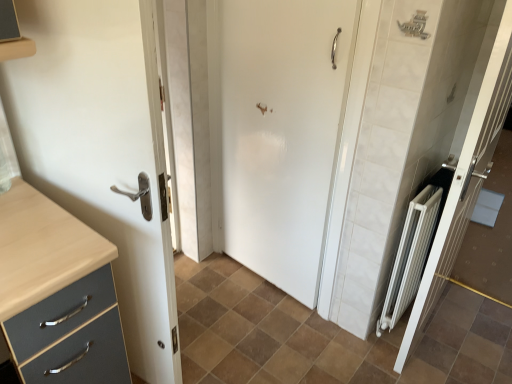
Identify the location of brown matte tile at center. (325, 335).

Locate an element on the screen. The width and height of the screenshot is (512, 384). brown matte tile at center is located at coordinates (325, 335).

Based on their sizes in the image, would you say white metallic radiator at right, marked as the third door in a left-to-right arrangement, is bigger or smaller than white matte door at center, arranged as the second door when viewed from the right?

Clearly, white metallic radiator at right, marked as the third door in a left-to-right arrangement, is larger in size than white matte door at center, arranged as the second door when viewed from the right.

From the image's perspective, is white metallic radiator at right, marked as the third door in a left-to-right arrangement, above white matte door at center, arranged as the 2th door when viewed from the left?

Incorrect, from the image's perspective, white metallic radiator at right, marked as the third door in a left-to-right arrangement, is lower than white matte door at center, arranged as the 2th door when viewed from the left.

From a real-world perspective, relative to white matte door at center, arranged as the second door when viewed from the right, is white metallic radiator at right, marked as the third door in a left-to-right arrangement, vertically above or below?

white metallic radiator at right, marked as the third door in a left-to-right arrangement, is situated higher than white matte door at center, arranged as the second door when viewed from the right, in the real world.

In the image, is white metallic radiator at right, marked as the third door in a left-to-right arrangement, on the left side or the right side of white matte door at center, arranged as the second door when viewed from the right?

Clearly, white metallic radiator at right, marked as the third door in a left-to-right arrangement, is on the right of white matte door at center, arranged as the second door when viewed from the right, in the image.

How distant is white metallic radiator at right, marked as the third door in a left-to-right arrangement, from white glossy door at left, marked as the 1th door in a left-to-right arrangement?

white metallic radiator at right, marked as the third door in a left-to-right arrangement, is 1.20 meters away from white glossy door at left, marked as the 1th door in a left-to-right arrangement.

From the image's perspective, relative to white glossy door at left, which appears as the third door when viewed from the right, is white metallic radiator at right, marked as the 1th door in a right-to-left arrangement, above or below?

white metallic radiator at right, marked as the 1th door in a right-to-left arrangement, is above white glossy door at left, which appears as the third door when viewed from the right.

Is white metallic radiator at right, marked as the 1th door in a right-to-left arrangement, smaller than white glossy door at left, which appears as the third door when viewed from the right?

Indeed, white metallic radiator at right, marked as the 1th door in a right-to-left arrangement, has a smaller size compared to white glossy door at left, which appears as the third door when viewed from the right.

Between white metallic radiator at right, marked as the 1th door in a right-to-left arrangement, and white glossy door at left, marked as the 1th door in a left-to-right arrangement, which one has less height?

Standing shorter between the two is white glossy door at left, marked as the 1th door in a left-to-right arrangement.

Is white glossy door at left, which appears as the third door when viewed from the right, inside or outside of brown matte tile at center?

The correct answer is: outside.

Between white glossy door at left, which appears as the third door when viewed from the right, and brown matte tile at center, which one has larger size?

Bigger between the two is white glossy door at left, which appears as the third door when viewed from the right.

Consider the image. From the image's perspective, between white glossy door at left, which appears as the third door when viewed from the right, and brown matte tile at center, who is located below?

brown matte tile at center, from the image's perspective.

Is white glossy door at left, which appears as the third door when viewed from the right, facing towards brown matte tile at center?

No, white glossy door at left, which appears as the third door when viewed from the right, does not turn towards brown matte tile at center.

Does white matte door at center, arranged as the 2th door when viewed from the left, appear on the right side of brown matte tile at center?

Incorrect, white matte door at center, arranged as the 2th door when viewed from the left, is not on the right side of brown matte tile at center.

Between white matte door at center, arranged as the 2th door when viewed from the left, and brown matte tile at center, which one has larger size?

brown matte tile at center.

From the picture: Measure the distance between white matte door at center, arranged as the second door when viewed from the right, and brown matte tile at center.

white matte door at center, arranged as the second door when viewed from the right, and brown matte tile at center are 28.48 inches apart from each other.

Does white matte door at center, arranged as the second door when viewed from the right, have a greater height compared to brown matte tile at center?

Yes, white matte door at center, arranged as the second door when viewed from the right, is taller than brown matte tile at center.

Does white glossy door at left, which appears as the third door when viewed from the right, come behind white matte door at center, arranged as the second door when viewed from the right?

No, white glossy door at left, which appears as the third door when viewed from the right, is in front of white matte door at center, arranged as the second door when viewed from the right.

From the image's perspective, is white glossy door at left, which appears as the third door when viewed from the right, above or below white matte door at center, arranged as the 2th door when viewed from the left?

Clearly, from the image's perspective, white glossy door at left, which appears as the third door when viewed from the right, is below white matte door at center, arranged as the 2th door when viewed from the left.

Are white glossy door at left, marked as the 1th door in a left-to-right arrangement, and white matte door at center, arranged as the 2th door when viewed from the left, far apart?

No.

Between white glossy door at left, which appears as the third door when viewed from the right, and white matte door at center, arranged as the second door when viewed from the right, which one appears on the right side from the viewer's perspective?

From the viewer's perspective, white matte door at center, arranged as the second door when viewed from the right, appears more on the right side.

Is white glossy door at left, which appears as the third door when viewed from the right, looking in the opposite direction of white metallic radiator at right, marked as the 1th door in a right-to-left arrangement?

That's not correct — white glossy door at left, which appears as the third door when viewed from the right, is not looking away from white metallic radiator at right, marked as the 1th door in a right-to-left arrangement.

From the image's perspective, is white glossy door at left, which appears as the third door when viewed from the right, on top of white metallic radiator at right, marked as the third door in a left-to-right arrangement?

No, from the image's perspective, white glossy door at left, which appears as the third door when viewed from the right, is not above white metallic radiator at right, marked as the third door in a left-to-right arrangement.

Considering the relative sizes of white glossy door at left, marked as the 1th door in a left-to-right arrangement, and white metallic radiator at right, marked as the third door in a left-to-right arrangement, in the image provided, is white glossy door at left, marked as the 1th door in a left-to-right arrangement, shorter than white metallic radiator at right, marked as the third door in a left-to-right arrangement,?

Correct, white glossy door at left, marked as the 1th door in a left-to-right arrangement, is not as tall as white metallic radiator at right, marked as the third door in a left-to-right arrangement.

Which of these two, white glossy door at left, marked as the 1th door in a left-to-right arrangement, or white metallic radiator at right, marked as the 1th door in a right-to-left arrangement, is thinner?

white metallic radiator at right, marked as the 1th door in a right-to-left arrangement, is thinner.

Is brown matte tile at center facing away from white metallic radiator at right, marked as the third door in a left-to-right arrangement?

brown matte tile at center does not have its back to white metallic radiator at right, marked as the third door in a left-to-right arrangement.

In the scene shown: Between brown matte tile at center and white metallic radiator at right, marked as the third door in a left-to-right arrangement, which one is positioned in front?

Positioned in front is white metallic radiator at right, marked as the third door in a left-to-right arrangement.

Considering the relative sizes of brown matte tile at center and white metallic radiator at right, marked as the 1th door in a right-to-left arrangement, in the image provided, is brown matte tile at center smaller than white metallic radiator at right, marked as the 1th door in a right-to-left arrangement,?

No.

I want to click on door located above the white metallic radiator at right, marked as the third door in a left-to-right arrangement (from the image's perspective), so click(x=283, y=132).

What are the coordinates of `door lying below the white metallic radiator at right, marked as the third door in a left-to-right arrangement (from the image's perspective)` in the screenshot? It's located at (102, 151).

Looking at this image, based on their spatial positions, is brown matte tile at center or white metallic radiator at right, marked as the 1th door in a right-to-left arrangement, closer to white matte door at center, arranged as the second door when viewed from the right?

white metallic radiator at right, marked as the 1th door in a right-to-left arrangement.

From the image, which object appears to be nearer to white glossy door at left, marked as the 1th door in a left-to-right arrangement, white metallic radiator at right, marked as the third door in a left-to-right arrangement, or brown matte tile at center?

Based on the image, brown matte tile at center appears to be nearer to white glossy door at left, marked as the 1th door in a left-to-right arrangement.

When comparing their distances from white glossy door at left, marked as the 1th door in a left-to-right arrangement, does brown matte tile at center or white matte door at center, arranged as the 2th door when viewed from the left, seem closer?

Based on the image, white matte door at center, arranged as the 2th door when viewed from the left, appears to be nearer to white glossy door at left, marked as the 1th door in a left-to-right arrangement.

From the picture: Estimate the real-world distances between objects in this image. Which object is further from white metallic radiator at right, marked as the third door in a left-to-right arrangement, white glossy door at left, marked as the 1th door in a left-to-right arrangement, or brown matte tile at center?

white glossy door at left, marked as the 1th door in a left-to-right arrangement, is further to white metallic radiator at right, marked as the third door in a left-to-right arrangement.

From the image, which object appears to be farther from white metallic radiator at right, marked as the 1th door in a right-to-left arrangement, brown matte tile at center or white matte door at center, arranged as the 2th door when viewed from the left?

Based on the image, white matte door at center, arranged as the 2th door when viewed from the left, appears to be further to white metallic radiator at right, marked as the 1th door in a right-to-left arrangement.

Which object lies further to the anchor point white metallic radiator at right, marked as the 1th door in a right-to-left arrangement, white matte door at center, arranged as the 2th door when viewed from the left, or brown matte tile at center?

The object further to white metallic radiator at right, marked as the 1th door in a right-to-left arrangement, is white matte door at center, arranged as the 2th door when viewed from the left.

From the image, which object appears to be nearer to white glossy door at left, which appears as the third door when viewed from the right, white matte door at center, arranged as the second door when viewed from the right, or white metallic radiator at right, marked as the 1th door in a right-to-left arrangement?

Among the two, white matte door at center, arranged as the second door when viewed from the right, is located nearer to white glossy door at left, which appears as the third door when viewed from the right.

From the image, which object appears to be farther from brown matte tile at center, white glossy door at left, which appears as the third door when viewed from the right, or white metallic radiator at right, marked as the 1th door in a right-to-left arrangement?

Among the two, white glossy door at left, which appears as the third door when viewed from the right, is located further to brown matte tile at center.

Where is `ceramic tile located between white matte door at center, arranged as the second door when viewed from the right, and white metallic radiator at right, marked as the 1th door in a right-to-left arrangement, in the left-right direction`? The image size is (512, 384). ceramic tile located between white matte door at center, arranged as the second door when viewed from the right, and white metallic radiator at right, marked as the 1th door in a right-to-left arrangement, in the left-right direction is located at coordinates pyautogui.click(x=325, y=335).

The image size is (512, 384). In order to click on ceramic tile between white glossy door at left, which appears as the third door when viewed from the right, and white metallic radiator at right, marked as the third door in a left-to-right arrangement in this screenshot , I will do `click(325, 335)`.

Where is `door situated between white glossy door at left, marked as the 1th door in a left-to-right arrangement, and brown matte tile at center from left to right`? The width and height of the screenshot is (512, 384). door situated between white glossy door at left, marked as the 1th door in a left-to-right arrangement, and brown matte tile at center from left to right is located at coordinates (283, 132).

Where is `door between white glossy door at left, marked as the 1th door in a left-to-right arrangement, and white metallic radiator at right, marked as the 1th door in a right-to-left arrangement, from left to right`? Image resolution: width=512 pixels, height=384 pixels. door between white glossy door at left, marked as the 1th door in a left-to-right arrangement, and white metallic radiator at right, marked as the 1th door in a right-to-left arrangement, from left to right is located at coordinates (283, 132).